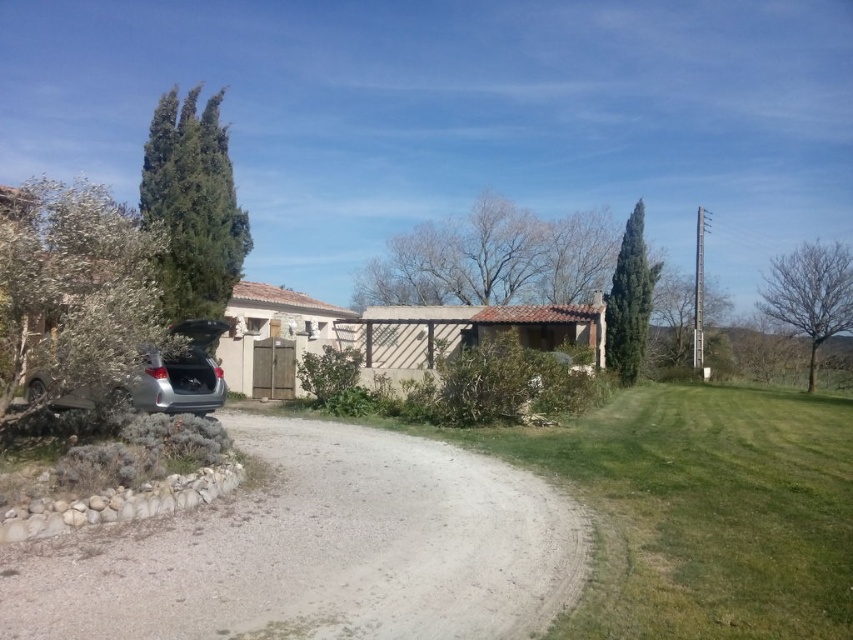
Does gray gravel driveway at lower left come in front of satin silver car at left?

That is True.

Which is behind, point (55, 582) or point (158, 401)?

The point (158, 401) is behind.

You are a GUI agent. You are given a task and a screenshot of the screen. Output one action in this format:
    pyautogui.click(x=<x>, y=<y>)
    Task: Click on the gray gravel driveway at lower left
    
    Given the screenshot: What is the action you would take?
    tap(318, 550)